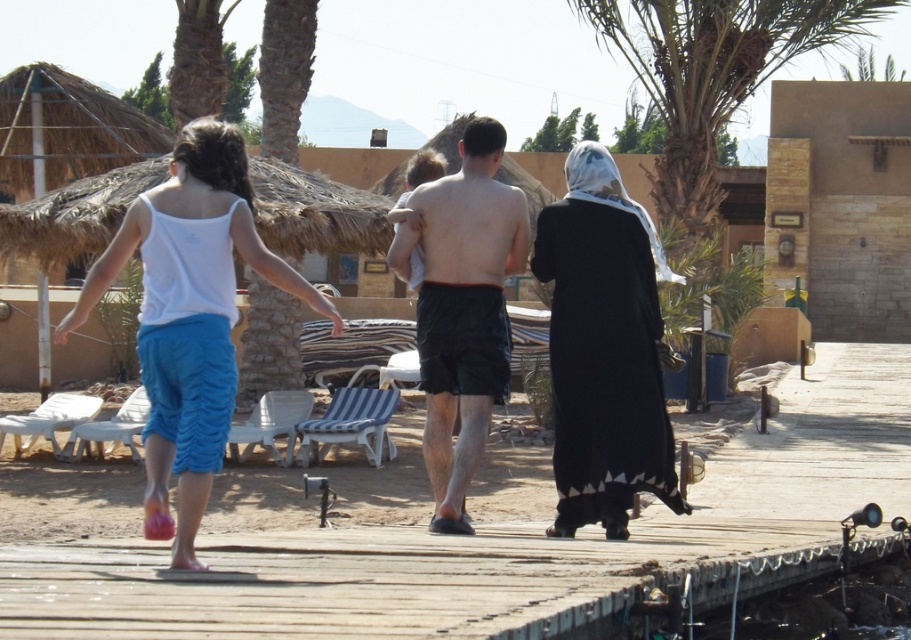
Question: Which of these objects is positioned closest to the green leafy palm tree at upper center?

Choices:
 (A) white cotton tank top at upper left
 (B) black cotton dress at center

Answer: (A)

Question: Which of the following is the farthest from the observer?

Choices:
 (A) (807, 392)
 (B) (779, 4)

Answer: (B)

Question: Can you confirm if white fabric dress at center is positioned to the left of black cotton dress at center?

Choices:
 (A) yes
 (B) no

Answer: (A)

Question: Which of the following is the closest to the observer?

Choices:
 (A) black matte shorts at center
 (B) black cotton dress at center
 (C) white cotton tank top at upper left
 (D) black fabric abaya at center

Answer: (D)

Question: Is the position of white cotton tank top at upper left more distant than that of black cotton dress at center?

Choices:
 (A) no
 (B) yes

Answer: (A)

Question: Can you confirm if wooden dock at center is positioned below black matte shorts at center?

Choices:
 (A) no
 (B) yes

Answer: (B)